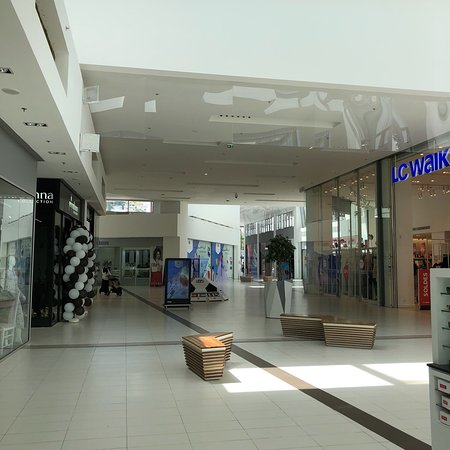
This screenshot has width=450, height=450. I want to click on ceiling, so click(x=255, y=118), click(x=175, y=155), click(x=66, y=127).